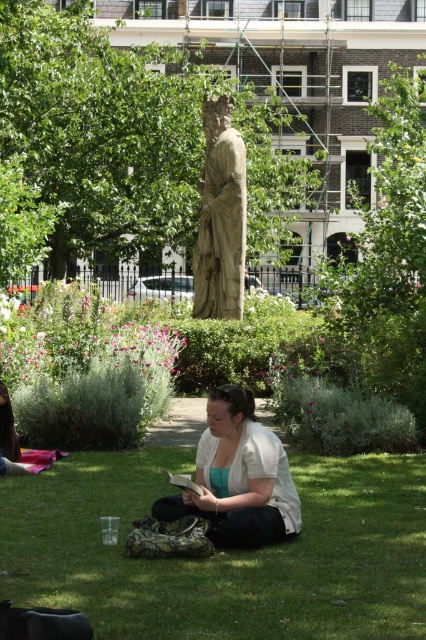
Question: Can you confirm if green grass at center is positioned to the right of stone statue at center?

Choices:
 (A) yes
 (B) no

Answer: (A)

Question: Can you confirm if green grass at center is positioned above stone statue at center?

Choices:
 (A) no
 (B) yes

Answer: (A)

Question: Estimate the real-world distances between objects in this image. Which object is farther from the green grass at center?

Choices:
 (A) white cotton shirt at center
 (B) stone statue at center

Answer: (B)

Question: Which of these objects is positioned closest to the white cotton shirt at center?

Choices:
 (A) green grass at center
 (B) stone statue at center

Answer: (A)

Question: Is green grass at center smaller than stone statue at center?

Choices:
 (A) yes
 (B) no

Answer: (A)

Question: Which is nearer to the stone statue at center?

Choices:
 (A) green grass at center
 (B) white cotton shirt at center

Answer: (B)